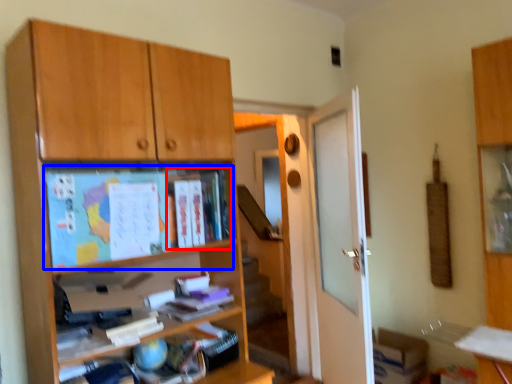
Question: Which point is closer to the camera, book (highlighted by a red box) or paperback book (highlighted by a blue box)?

Choices:
 (A) book
 (B) paperback book

Answer: (B)